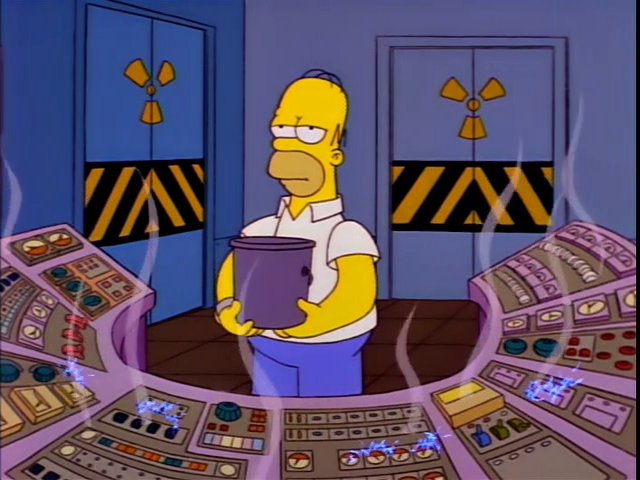
Locate an element on the screen. switches is located at coordinates (81, 318), (75, 335), (73, 346), (481, 435), (502, 434), (520, 426).